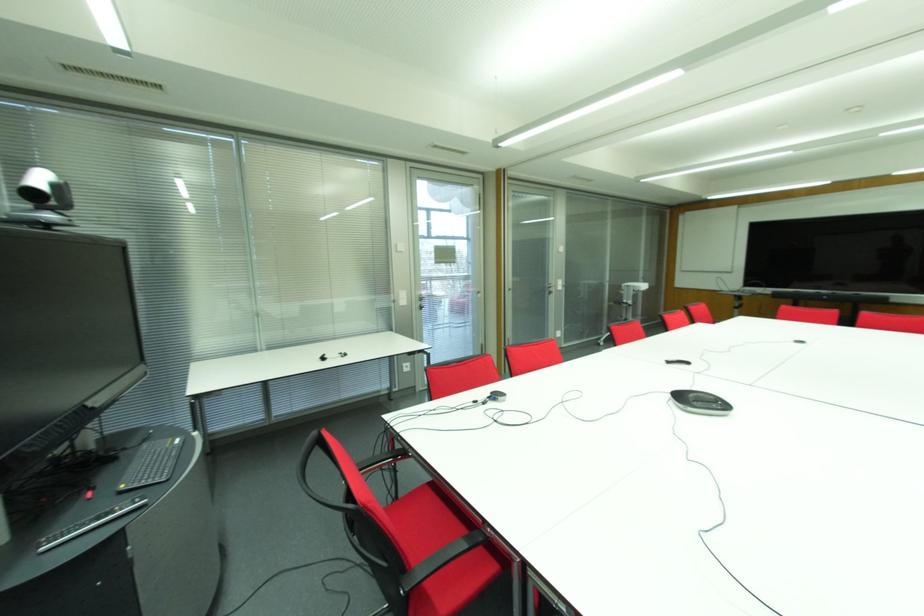
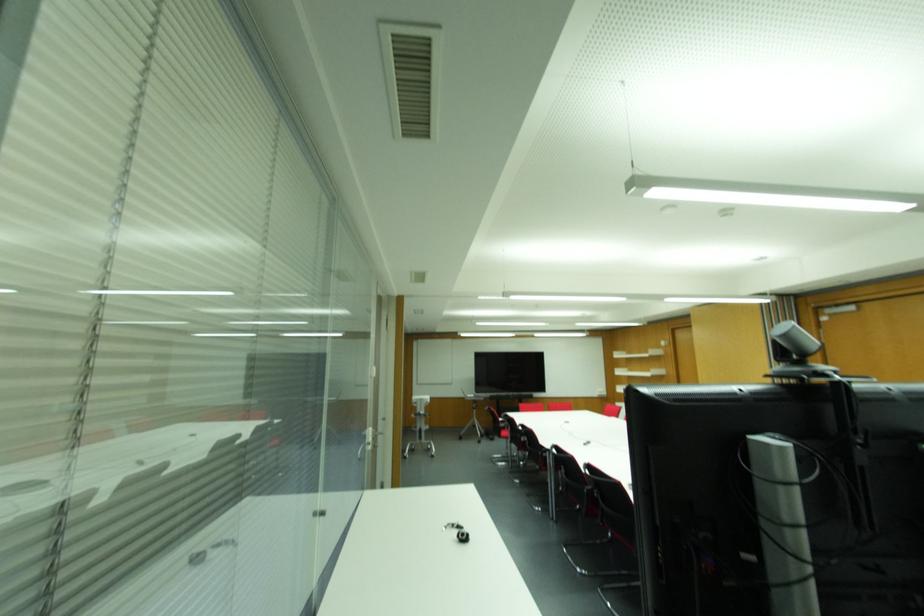
The point at (736,310) is marked in the first image. Where is the corresponding point in the second image?

(473, 410)